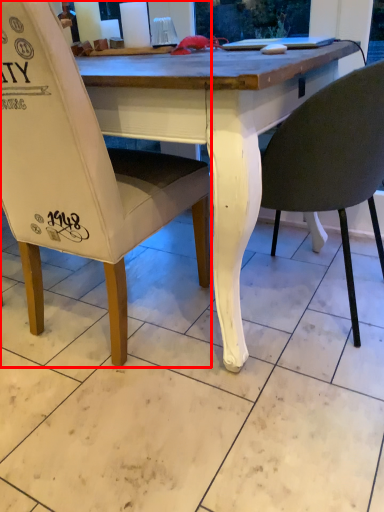
Question: From the image's perspective, where is chair (annotated by the red box) located relative to chair?

Choices:
 (A) above
 (B) below

Answer: (A)